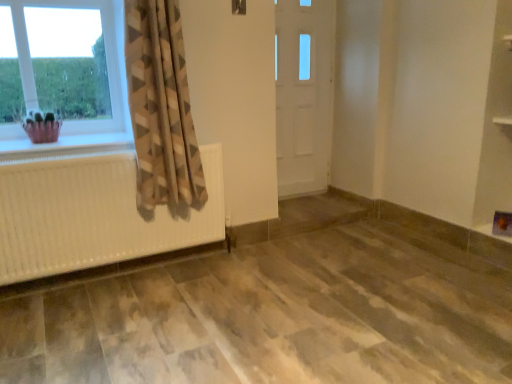
Question: Can we say white wooden door at center lies outside beige textured curtain at left?

Choices:
 (A) no
 (B) yes

Answer: (B)

Question: From a real-world perspective, is white wooden door at center over beige textured curtain at left?

Choices:
 (A) yes
 (B) no

Answer: (B)

Question: From a real-world perspective, is white wooden door at center beneath beige textured curtain at left?

Choices:
 (A) yes
 (B) no

Answer: (A)

Question: Does white wooden door at center appear on the left side of beige textured curtain at left?

Choices:
 (A) yes
 (B) no

Answer: (B)

Question: Is white wooden door at center wider than beige textured curtain at left?

Choices:
 (A) no
 (B) yes

Answer: (A)

Question: From a real-world perspective, is white wooden door at center physically located above or below beige textured curtain at left?

Choices:
 (A) above
 (B) below

Answer: (B)

Question: Considering the positions of white wooden door at center and beige textured curtain at left in the image, is white wooden door at center taller or shorter than beige textured curtain at left?

Choices:
 (A) tall
 (B) short

Answer: (A)

Question: Is point (275, 49) positioned closer to the camera than point (181, 77)?

Choices:
 (A) closer
 (B) farther

Answer: (B)

Question: In the image, is white wooden door at center on the left side or the right side of beige textured curtain at left?

Choices:
 (A) right
 (B) left

Answer: (A)

Question: Considering their positions, is beige textured curtain at left located in front of or behind pink fabric basket at left?

Choices:
 (A) front
 (B) behind

Answer: (A)

Question: Looking at their shapes, would you say beige textured curtain at left is wider or thinner than pink fabric basket at left?

Choices:
 (A) thin
 (B) wide

Answer: (B)

Question: Is point (161, 190) closer or farther from the camera than point (30, 135)?

Choices:
 (A) farther
 (B) closer

Answer: (A)

Question: Is beige textured curtain at left to the left or to the right of pink fabric basket at left in the image?

Choices:
 (A) left
 (B) right

Answer: (B)

Question: From their relative heights in the image, would you say beige textured curtain at left is taller or shorter than white textured radiator at left?

Choices:
 (A) short
 (B) tall

Answer: (B)

Question: From the image's perspective, is beige textured curtain at left positioned above or below white textured radiator at left?

Choices:
 (A) above
 (B) below

Answer: (A)